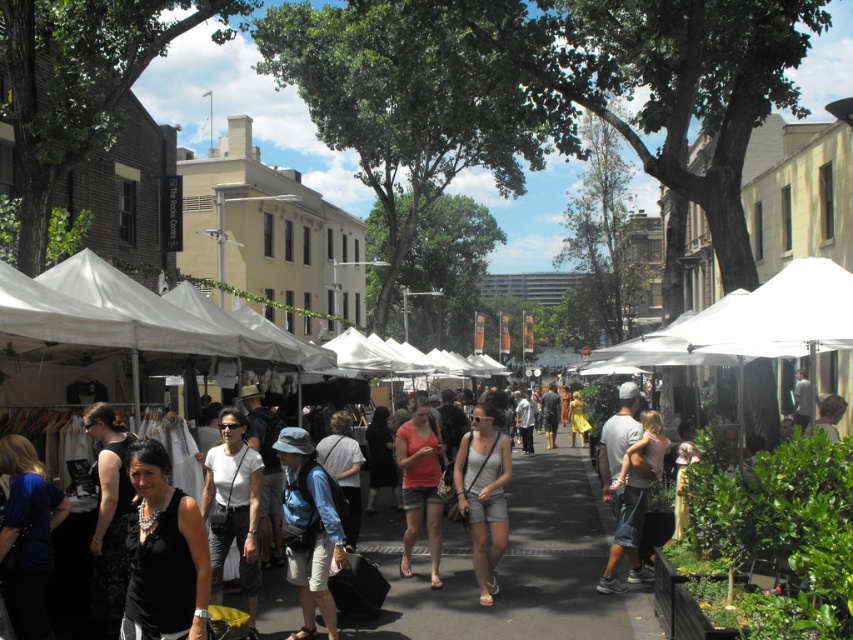
Find the location of a particular element. The image size is (853, 640). white fabric tents at center is located at coordinates (796, 481).

Is white fabric tents at center positioned before blue denim shorts at center?

Yes, it is in front of blue denim shorts at center.

Between point (521, 522) and point (341, 560), which one is positioned in front?

Point (341, 560) is more forward.

Image resolution: width=853 pixels, height=640 pixels. What are the coordinates of `white fabric tents at center` in the screenshot? It's located at (796, 481).

Is point (318, 568) less distant than point (231, 500)?

Yes, it is in front of point (231, 500).

Which is in front, point (308, 556) or point (247, 461)?

Positioned in front is point (308, 556).

The height and width of the screenshot is (640, 853). In order to click on blue denim shorts at center in this screenshot , I will do `click(309, 529)`.

Image resolution: width=853 pixels, height=640 pixels. I want to click on blue denim shorts at center, so click(309, 529).

Is white matte shirt at center in front of light gray denim shorts at center?

→ Yes, it is.

Can you confirm if white matte shirt at center is wider than light gray denim shorts at center?

Indeed, white matte shirt at center has a greater width compared to light gray denim shorts at center.

Which is behind, point (231, 486) or point (476, 413)?

The point (476, 413) is behind.

You are a GUI agent. You are given a task and a screenshot of the screen. Output one action in this format:
    pyautogui.click(x=<x>, y=<y>)
    Task: Click on the white matte shirt at center
    Image resolution: width=853 pixels, height=640 pixels.
    Given the screenshot: What is the action you would take?
    pyautogui.click(x=233, y=508)